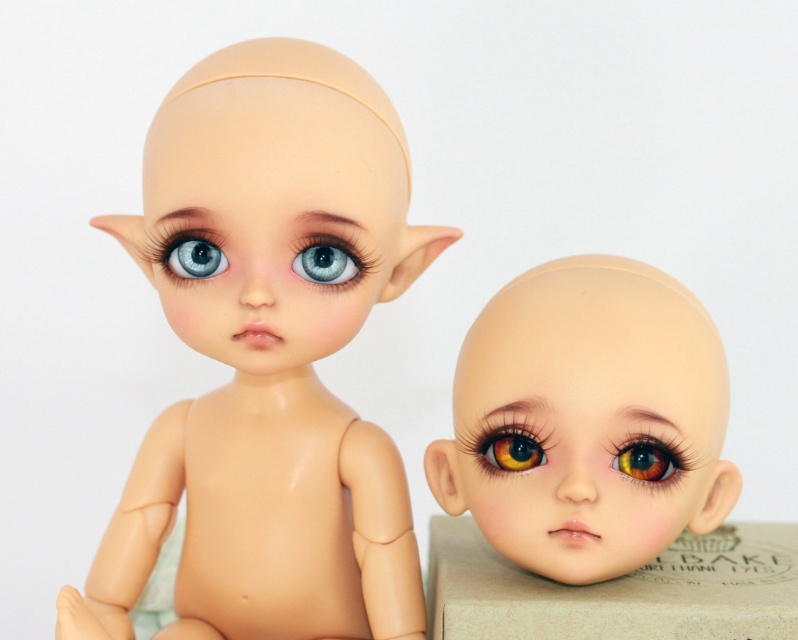
Question: Estimate the real-world distances between objects in this image. Which object is farther from the brown glossy eye at center?

Choices:
 (A) matte plastic head at center
 (B) matte plastic eye at upper left
 (C) matte plastic eye at center

Answer: (B)

Question: Which object appears closest to the camera in this image?

Choices:
 (A) matte beige head at center
 (B) multicolored glossy eye at center

Answer: (A)

Question: Estimate the real-world distances between objects in this image. Which object is closer to the matte beige head at center?

Choices:
 (A) beige cardboard box at lower center
 (B) multicolored glossy eye at center
 (C) matte plastic eye at upper left

Answer: (B)

Question: Considering the relative positions of multicolored glossy eye at center and matte plastic eye at upper left in the image provided, where is multicolored glossy eye at center located with respect to matte plastic eye at upper left?

Choices:
 (A) left
 (B) right

Answer: (B)

Question: In this image, where is brown glossy eye at center located relative to multicolored glossy eye at center?

Choices:
 (A) above
 (B) below

Answer: (A)

Question: Is beige cardboard box at lower center in front of multicolored glossy eye at center?

Choices:
 (A) yes
 (B) no

Answer: (B)